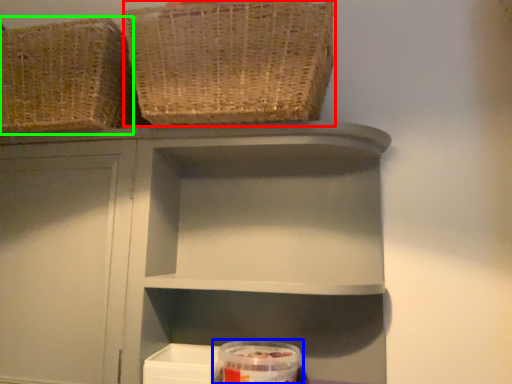
Question: Considering the real-world distances, which object is farthest from basket (highlighted by a red box)? glass jar (highlighted by a blue box) or basket (highlighted by a green box)?

Choices:
 (A) glass jar
 (B) basket

Answer: (A)